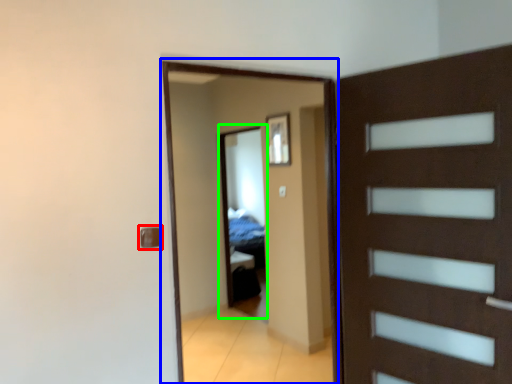
Question: Which is nearer to the door handle (highlighted by a red box)? screen door (highlighted by a blue box) or mirror (highlighted by a green box).

Choices:
 (A) screen door
 (B) mirror

Answer: (A)